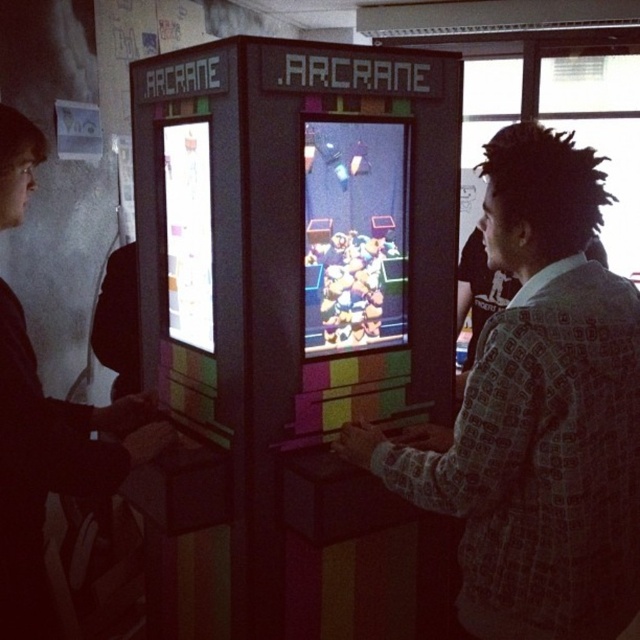
Question: Does patterned shirt at center appear under dark gray sweater at left?

Choices:
 (A) yes
 (B) no

Answer: (B)

Question: Which object is closer to the camera taking this photo?

Choices:
 (A) patterned shirt at center
 (B) dark gray sweater at left

Answer: (A)

Question: Which of the following is the farthest from the observer?

Choices:
 (A) coord(440,477)
 (B) coord(29,538)

Answer: (B)

Question: Is patterned shirt at center closer to the viewer compared to dark gray sweater at left?

Choices:
 (A) yes
 (B) no

Answer: (A)

Question: Is patterned shirt at center to the left of dark gray sweater at left from the viewer's perspective?

Choices:
 (A) yes
 (B) no

Answer: (B)